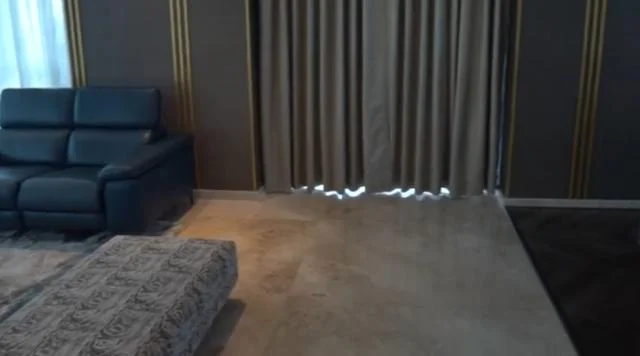
Identify the location of right of couch. This screenshot has width=640, height=356. (227, 214).